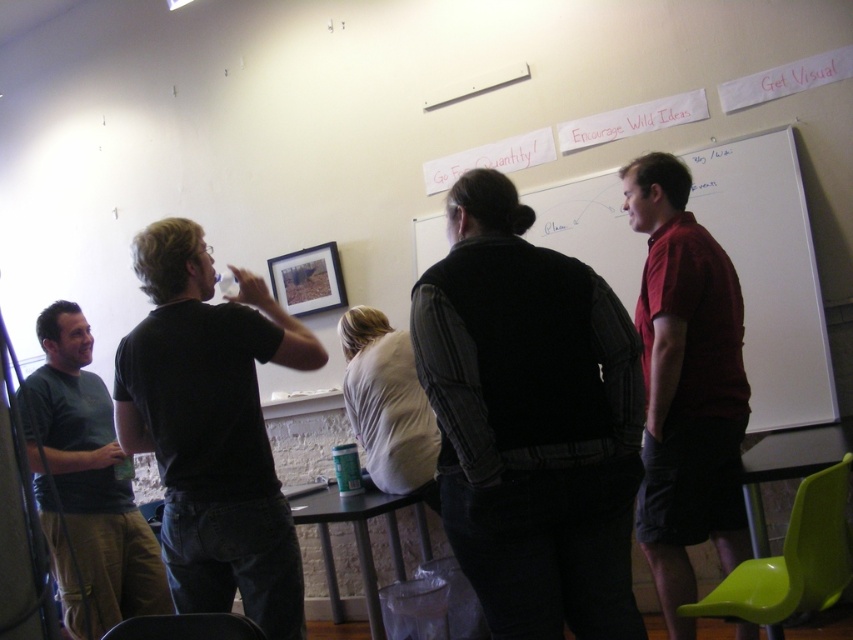
Who is shorter, whiteboard at center or dark green t-shirt at left?

→ Standing shorter between the two is whiteboard at center.

Looking at this image, is whiteboard at center smaller than dark green t-shirt at left?

Indeed, whiteboard at center has a smaller size compared to dark green t-shirt at left.

Between point (703, 147) and point (97, 456), which one is positioned behind?

The point (703, 147) is more distant.

The image size is (853, 640). I want to click on whiteboard at center, so click(769, 273).

Between black matte t-shirt at left and dark green t-shirt at left, which one is positioned lower?

dark green t-shirt at left is lower down.

Who is taller, black matte t-shirt at left or dark green t-shirt at left?

With more height is dark green t-shirt at left.

Who is more distant from viewer, (148, 387) or (119, 472)?

Point (119, 472)

Identify the location of black matte t-shirt at left. (212, 428).

Identify the location of dark gray vest at center. (531, 420).

You are a GUI agent. You are given a task and a screenshot of the screen. Output one action in this format:
    pyautogui.click(x=<x>, y=<y>)
    Task: Click on the dark gray vest at center
    The image size is (853, 640).
    Given the screenshot: What is the action you would take?
    pyautogui.click(x=531, y=420)